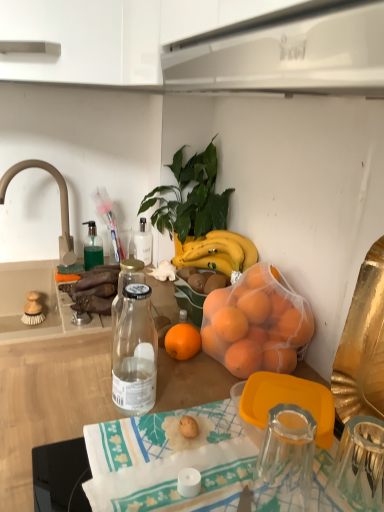
Question: In terms of height, does printed fabric tablecloth at center look taller or shorter compared to white glossy range hood at upper center?

Choices:
 (A) short
 (B) tall

Answer: (A)

Question: Looking at the image, does printed fabric tablecloth at center seem bigger or smaller compared to white glossy range hood at upper center?

Choices:
 (A) small
 (B) big

Answer: (B)

Question: Which is farther from the white glossy range hood at upper center?

Choices:
 (A) transparent glass coffee cup at center
 (B) beige matte faucet at upper left
 (C) printed fabric tablecloth at center
 (D) translucent glass soap dispenser at upper left
 (E) green leafy plant at upper center

Answer: (D)

Question: Which is farther from the transparent glass coffee cup at center?

Choices:
 (A) translucent glass soap dispenser at upper left
 (B) white glossy range hood at upper center
 (C) beige matte faucet at upper left
 (D) printed fabric tablecloth at center
 (E) green leafy plant at upper center

Answer: (C)